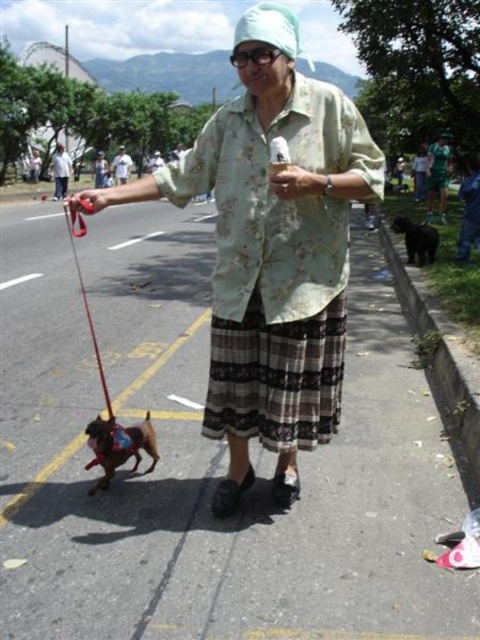
You are a delivery robot that needs to place a package on the smooth asphalt road at center. However, there is a plaid fabric skirt at center nearby. Which surface can you safely place the package on?

The smooth asphalt road at center is larger in size than the plaid fabric skirt at center, so the package can be safely placed on the smooth asphalt road at center.

The scene shows an older woman wearing a plaid fabric skirt at center and holding a black fur dog at right. Which object takes up more space in the image?

The black fur dog at right takes up more space in the image because it is larger than the plaid fabric skirt at center.